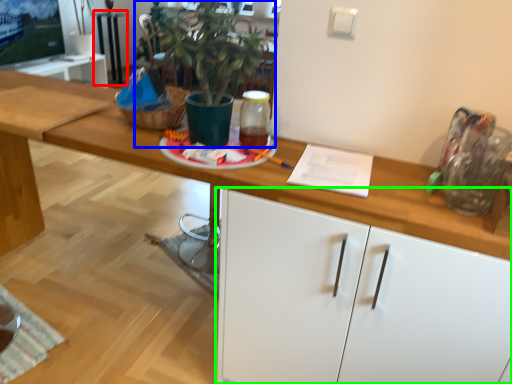
Question: Which object is positioned closest to table (highlighted by a red box)? Select from houseplant (highlighted by a blue box) and cabinetry (highlighted by a green box).

Choices:
 (A) houseplant
 (B) cabinetry

Answer: (A)